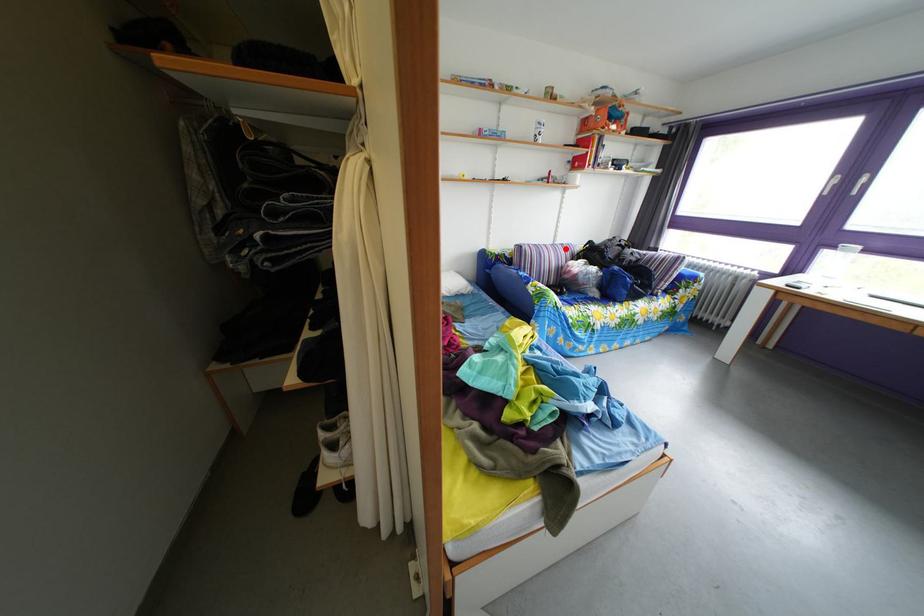
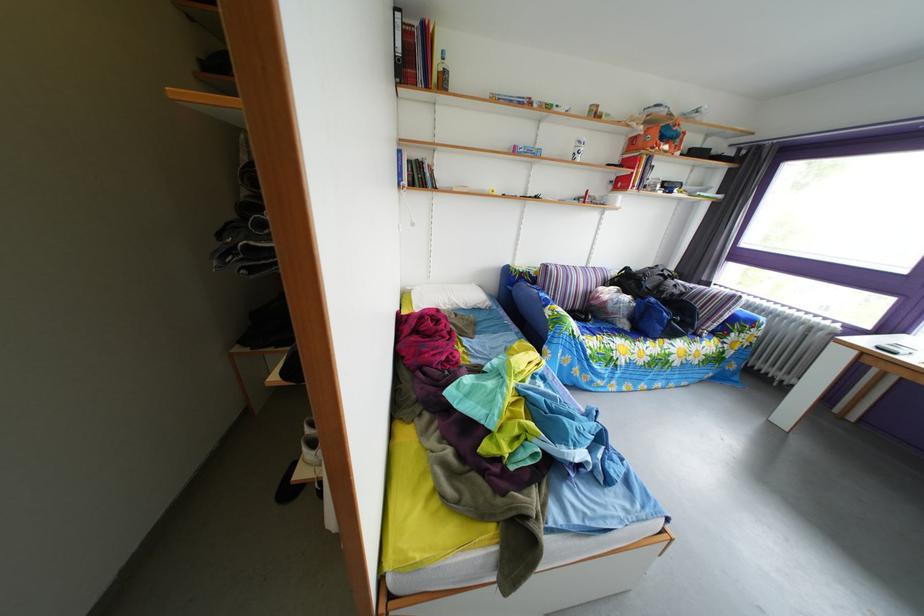
Find the pixel in the second image that matches the highlighted location in the first image.

(599, 270)